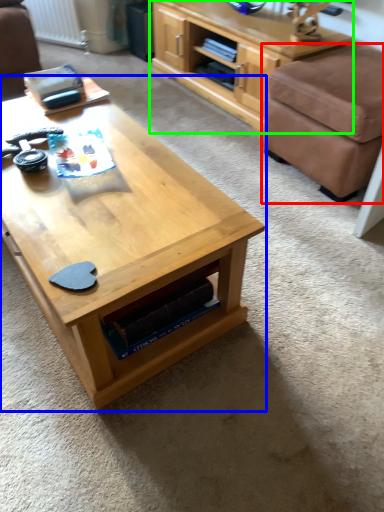
Question: Which is nearer to the stool (highlighted by a red box)? coffee table (highlighted by a blue box) or shelf (highlighted by a green box).

Choices:
 (A) coffee table
 (B) shelf

Answer: (B)